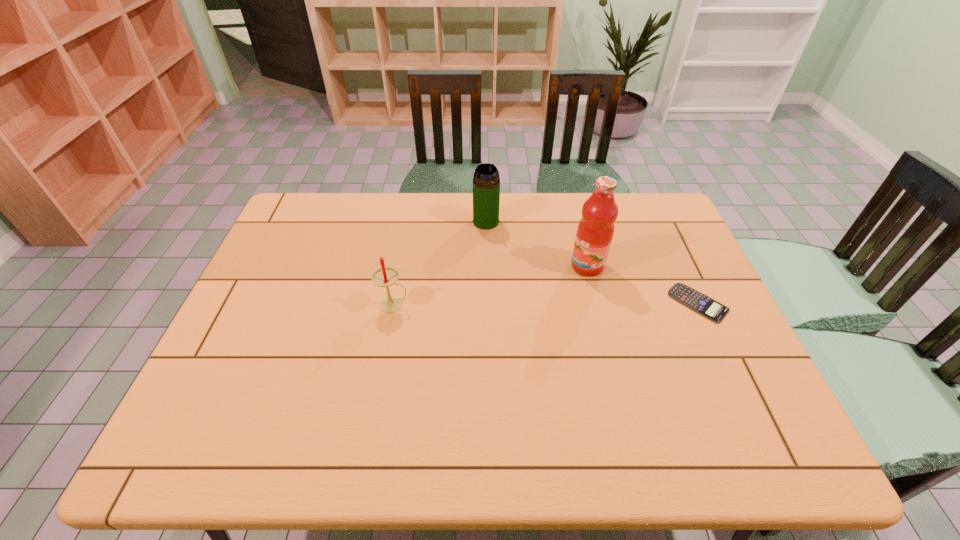
Where is `the leftmost object`? the leftmost object is located at coordinates (384, 277).

Locate an element on the screen. This screenshot has height=540, width=960. candle is located at coordinates (384, 277).

This screenshot has height=540, width=960. What are the coordinates of `the rightmost object` in the screenshot? It's located at (693, 299).

Where is `the shortest object`? the shortest object is located at coordinates (693, 299).

Identify the location of the tallest object. (595, 231).

Identify the location of fruit juice. (595, 231).

This screenshot has height=540, width=960. In order to click on thermos bottle in this screenshot , I will do `click(486, 183)`.

Where is `the second object from left to right`? The image size is (960, 540). the second object from left to right is located at coordinates pos(486,183).

The image size is (960, 540). I want to click on vacant space located 0.210m on the right of the leftmost object, so click(487, 305).

In order to click on free space located 0.120m on the left of the calculator in this screenshot , I will do `click(627, 303)`.